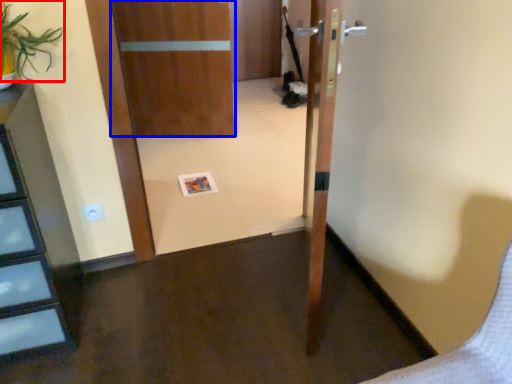
Question: Which of the following is the closest to the observer, plant (highlighted by a red box) or door (highlighted by a blue box)?

Choices:
 (A) plant
 (B) door

Answer: (A)